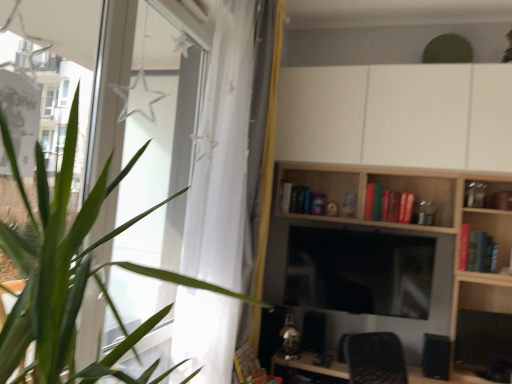
At what (x,y) coordinates should I click in order to perform the action: click on vacant area on top of hardcover book at center, the first book viewed from the front (from a real-world perspective). Please return your answer as a coordinate pair (x, y). The height and width of the screenshot is (384, 512). Looking at the image, I should click on (475, 220).